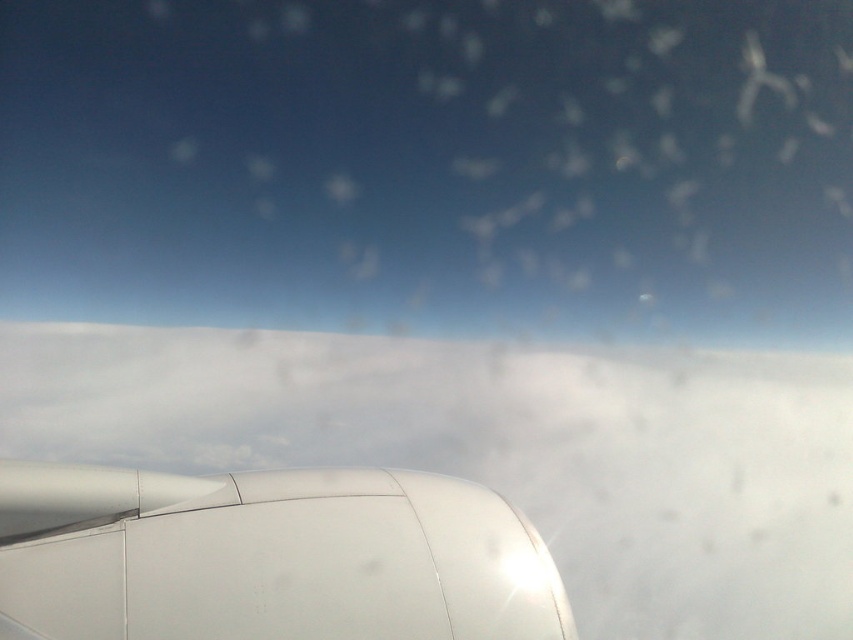
You are a pilot checking the visibility from the cockpit window. You see the white matte cloud at center and the white matte engine at lower left. Which object appears bigger in the window?

The white matte cloud at center appears bigger in the window than the white matte engine at lower left because it has a larger size compared to the engine.

You are a pilot checking the aircraft engine and the clouds outside. From your seat, you notice the white matte cloud at center and the white matte engine at lower left. Which object appears taller in the scene?

The white matte cloud at center is taller than the white matte engine at lower left according to the description.